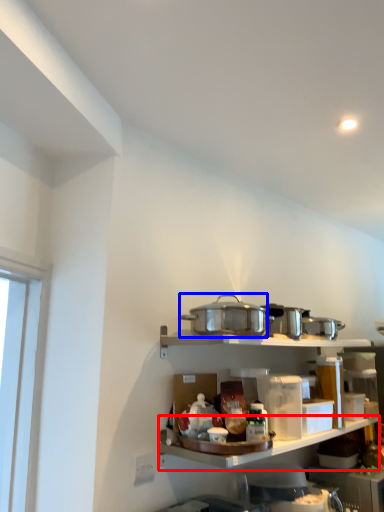
Question: Which of the following is the closest to the observer, shelf (highlighted by a red box) or appliance (highlighted by a blue box)?

Choices:
 (A) shelf
 (B) appliance

Answer: (A)